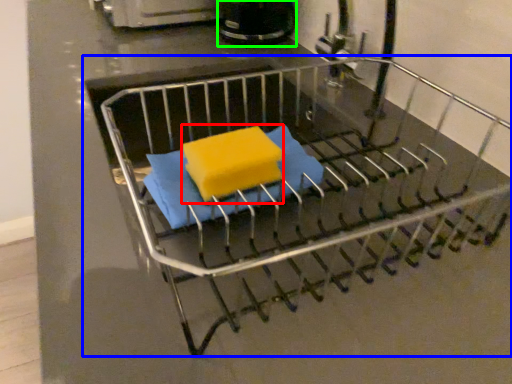
Question: Which object is positioned farthest from cheese (highlighted by a red box)? Select from furniture (highlighted by a blue box) and appliance (highlighted by a green box).

Choices:
 (A) furniture
 (B) appliance

Answer: (B)